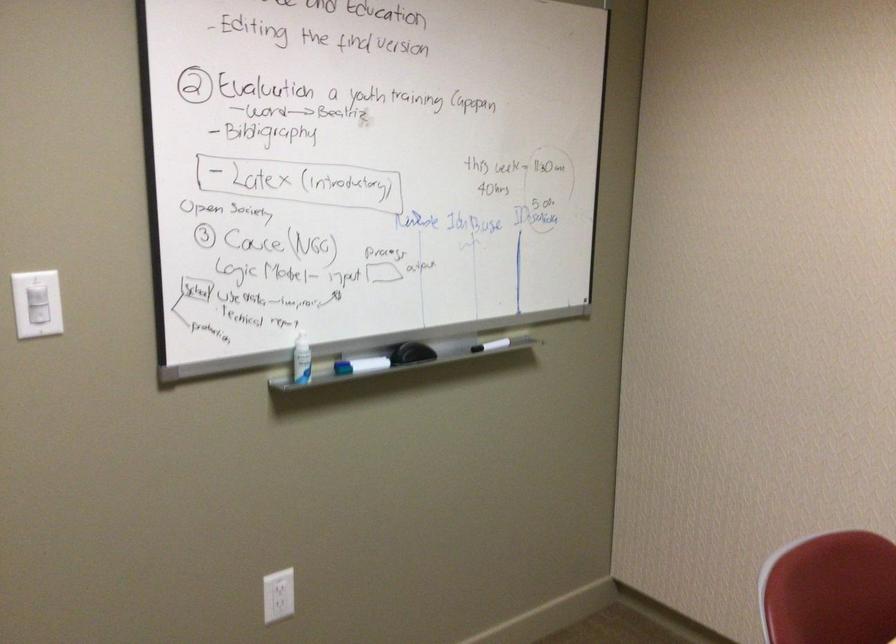
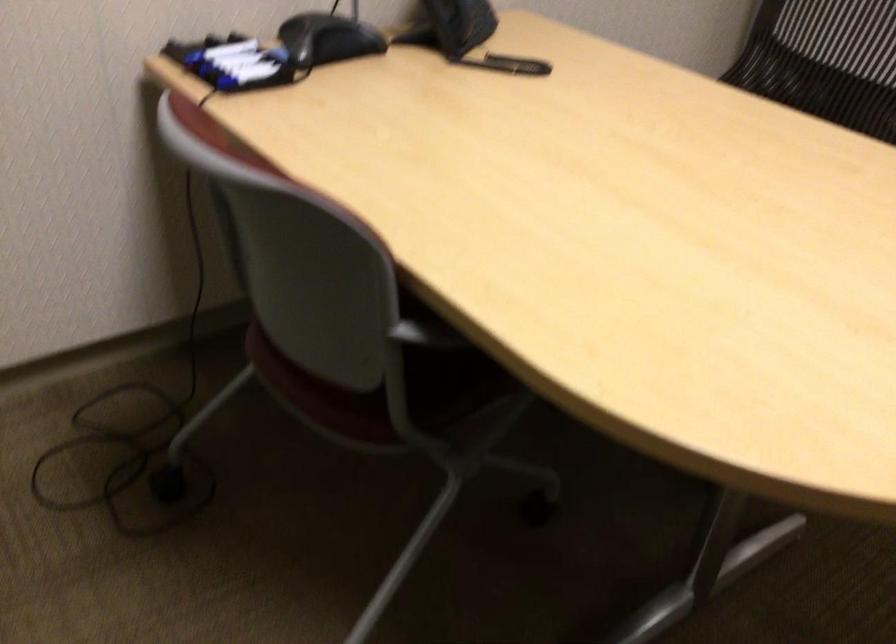
From the picture: The images are taken continuously from a first-person perspective. In which direction is your viewpoint rotating?

The camera's rotation is toward right-down.